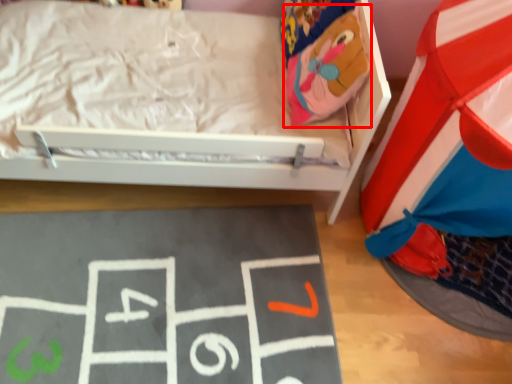
Question: From the image's perspective, where is bean bag chair (annotated by the red box) located in relation to bulletin board in the image?

Choices:
 (A) above
 (B) below

Answer: (A)